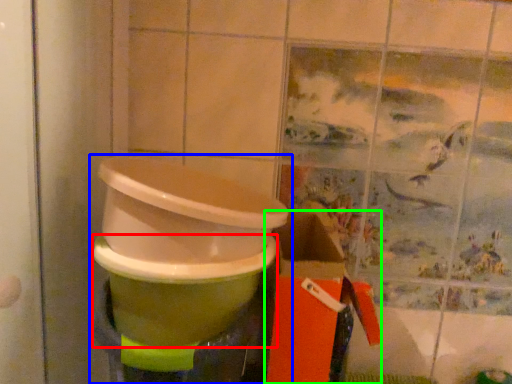
Question: Considering the real-world distances, which object is closest to toilet bowl (highlighted by a red box)? waste container (highlighted by a blue box) or box (highlighted by a green box).

Choices:
 (A) waste container
 (B) box

Answer: (A)